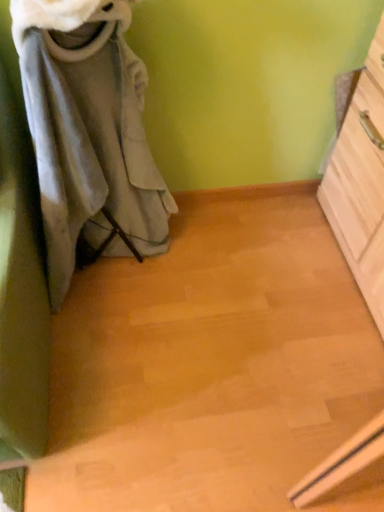
Find the location of a particular element. light wood chest of drawers at right is located at coordinates (361, 182).

This screenshot has width=384, height=512. What do you see at coordinates (361, 182) in the screenshot? I see `light wood chest of drawers at right` at bounding box center [361, 182].

Locate an element on the screen. This screenshot has width=384, height=512. gray fabric laundry at left is located at coordinates (88, 131).

Describe the element at coordinates (88, 131) in the screenshot. I see `gray fabric laundry at left` at that location.

Locate an element on the screen. The image size is (384, 512). light wood chest of drawers at right is located at coordinates (361, 182).

Considering the positions of objects gray fabric laundry at left and light wood chest of drawers at right in the image provided, who is more to the left, gray fabric laundry at left or light wood chest of drawers at right?

gray fabric laundry at left is more to the left.

Is gray fabric laundry at left positioned before light wood chest of drawers at right?

That is True.

Which is farther, (121, 4) or (362, 99)?

The point (362, 99) is behind.

From the image's perspective, is gray fabric laundry at left located above light wood chest of drawers at right?

Indeed, from the image's perspective, gray fabric laundry at left is shown above light wood chest of drawers at right.

From a real-world perspective, is gray fabric laundry at left below light wood chest of drawers at right?

Actually, gray fabric laundry at left is physically above light wood chest of drawers at right in the real world.

Consider the image. Which object is wider, gray fabric laundry at left or light wood chest of drawers at right?

gray fabric laundry at left.

Is gray fabric laundry at left taller than light wood chest of drawers at right?

Yes.

Is gray fabric laundry at left bigger or smaller than light wood chest of drawers at right?

gray fabric laundry at left is smaller than light wood chest of drawers at right.

Can we say gray fabric laundry at left lies outside light wood chest of drawers at right?

Yes, gray fabric laundry at left is located beyond the bounds of light wood chest of drawers at right.

Is gray fabric laundry at left far from light wood chest of drawers at right?

No, there isn't a large distance between gray fabric laundry at left and light wood chest of drawers at right.

Is gray fabric laundry at left facing away from light wood chest of drawers at right?

gray fabric laundry at left is not turned away from light wood chest of drawers at right.

How many degrees apart are the facing directions of gray fabric laundry at left and light wood chest of drawers at right?

91.9 degrees separate the facing orientations of gray fabric laundry at left and light wood chest of drawers at right.

How distant is gray fabric laundry at left from light wood chest of drawers at right?

gray fabric laundry at left is 78.34 centimeters away from light wood chest of drawers at right.

You are a GUI agent. You are given a task and a screenshot of the screen. Output one action in this format:
    pyautogui.click(x=<x>, y=<y>)
    Task: Click on the laundry above the light wood chest of drawers at right (from a real-world perspective)
    The image size is (384, 512).
    Given the screenshot: What is the action you would take?
    pyautogui.click(x=88, y=131)

Considering the relative positions of light wood chest of drawers at right and gray fabric laundry at left in the image provided, is light wood chest of drawers at right to the right of gray fabric laundry at left from the viewer's perspective?

Indeed, light wood chest of drawers at right is positioned on the right side of gray fabric laundry at left.

Does light wood chest of drawers at right come in front of gray fabric laundry at left?

No, it is behind gray fabric laundry at left.

Looking at this image, which is nearer, (375,192) or (69,13)?

The point (69,13) is closer to the camera.

From the image's perspective, would you say light wood chest of drawers at right is positioned over gray fabric laundry at left?

Actually, light wood chest of drawers at right appears below gray fabric laundry at left in the image.

From a real-world perspective, is light wood chest of drawers at right below gray fabric laundry at left?

Yes, from a real-world perspective, light wood chest of drawers at right is beneath gray fabric laundry at left.

Is light wood chest of drawers at right thinner than gray fabric laundry at left?

Yes, light wood chest of drawers at right is thinner than gray fabric laundry at left.

Is light wood chest of drawers at right taller or shorter than gray fabric laundry at left?

light wood chest of drawers at right is shorter than gray fabric laundry at left.

Can you confirm if light wood chest of drawers at right is bigger than gray fabric laundry at left?

Yes, light wood chest of drawers at right is bigger than gray fabric laundry at left.

Would you say light wood chest of drawers at right is outside gray fabric laundry at left?

Yes, light wood chest of drawers at right is located beyond the bounds of gray fabric laundry at left.

Is light wood chest of drawers at right touching gray fabric laundry at left?

No, light wood chest of drawers at right is not touching gray fabric laundry at left.

Is light wood chest of drawers at right oriented towards gray fabric laundry at left?

Yes, light wood chest of drawers at right faces towards gray fabric laundry at left.

You are a GUI agent. You are given a task and a screenshot of the screen. Output one action in this format:
    pyautogui.click(x=<x>, y=<y>)
    Task: Click on the chest of drawers below the gray fabric laundry at left (from the image's perspective)
    This screenshot has width=384, height=512.
    Given the screenshot: What is the action you would take?
    pyautogui.click(x=361, y=182)

In order to click on laundry on the left of the light wood chest of drawers at right in this screenshot , I will do `click(88, 131)`.

At what (x,y) coordinates should I click in order to perform the action: click on the chest of drawers below the gray fabric laundry at left (from the image's perspective). Please return your answer as a coordinate pair (x, y). Looking at the image, I should click on (361, 182).